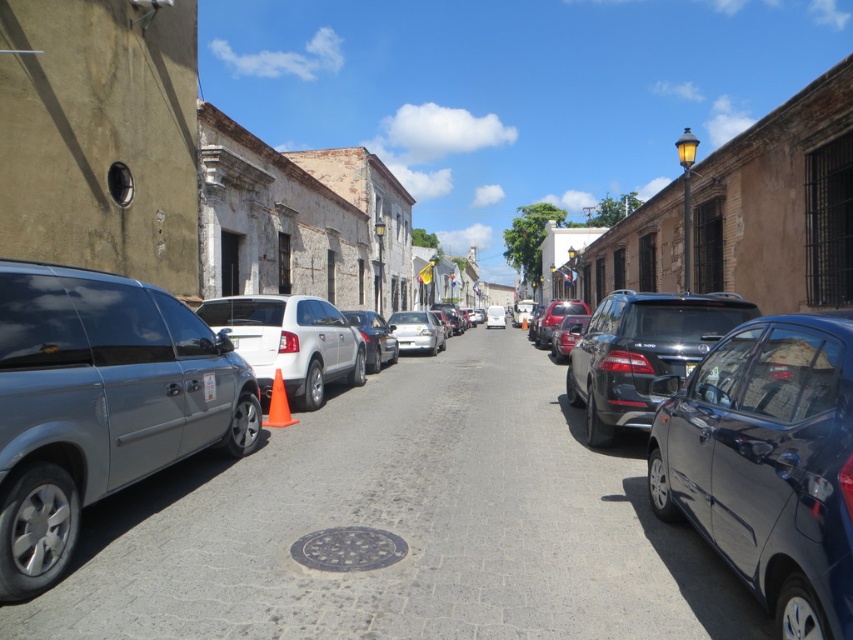
Who is positioned more to the right, glossy dark blue car at right or white matte suv at center?

glossy dark blue car at right is more to the right.

You are a GUI agent. You are given a task and a screenshot of the screen. Output one action in this format:
    pyautogui.click(x=<x>, y=<y>)
    Task: Click on the glossy dark blue car at right
    This screenshot has width=853, height=640.
    Given the screenshot: What is the action you would take?
    pyautogui.click(x=767, y=465)

At what (x,y) coordinates should I click in order to perform the action: click on glossy dark blue car at right. Please return your answer as a coordinate pair (x, y). The width and height of the screenshot is (853, 640). Looking at the image, I should click on (767, 465).

Between metallic silver van at left and white matte car at center, which one has more height?

Standing taller between the two is white matte car at center.

Can you confirm if metallic silver van at left is positioned to the right of white matte car at center?

Correct, you'll find metallic silver van at left to the right of white matte car at center.

The image size is (853, 640). Describe the element at coordinates (402, 525) in the screenshot. I see `metallic silver van at left` at that location.

You are a GUI agent. You are given a task and a screenshot of the screen. Output one action in this format:
    pyautogui.click(x=<x>, y=<y>)
    Task: Click on the metallic silver van at left
    The image size is (853, 640).
    Given the screenshot: What is the action you would take?
    pyautogui.click(x=402, y=525)

Who is more forward, (4, 579) or (374, 320)?

Positioned in front is point (4, 579).

Is satin silver van at left to the right of satin silver sedan at center from the viewer's perspective?

Indeed, satin silver van at left is positioned on the right side of satin silver sedan at center.

Is point (15, 512) in front of point (383, 340)?

Yes, point (15, 512) is in front of point (383, 340).

Locate an element on the screen. Image resolution: width=853 pixels, height=640 pixels. satin silver van at left is located at coordinates (99, 403).